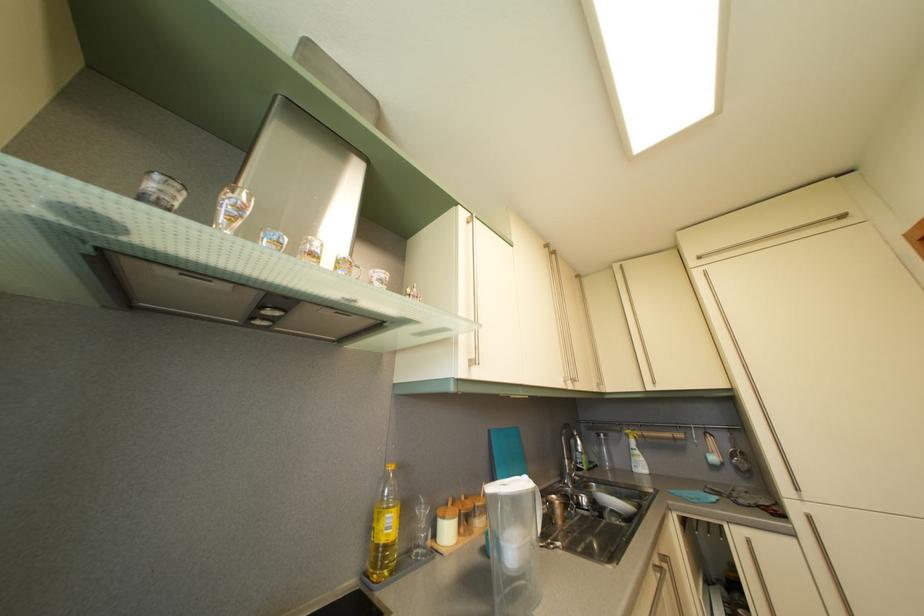
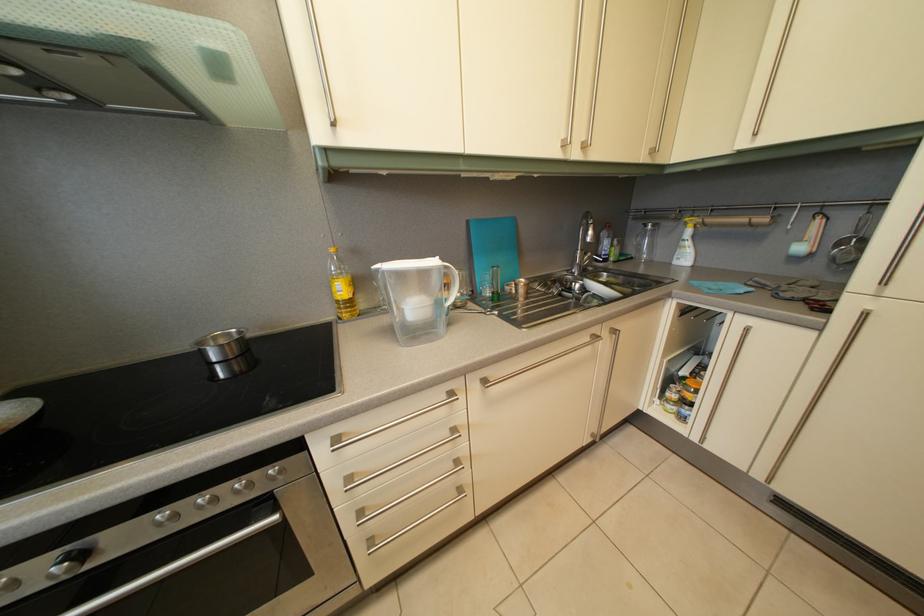
In the second image, find the point that corresponds to pixel 396 533 in the first image.

(349, 297)